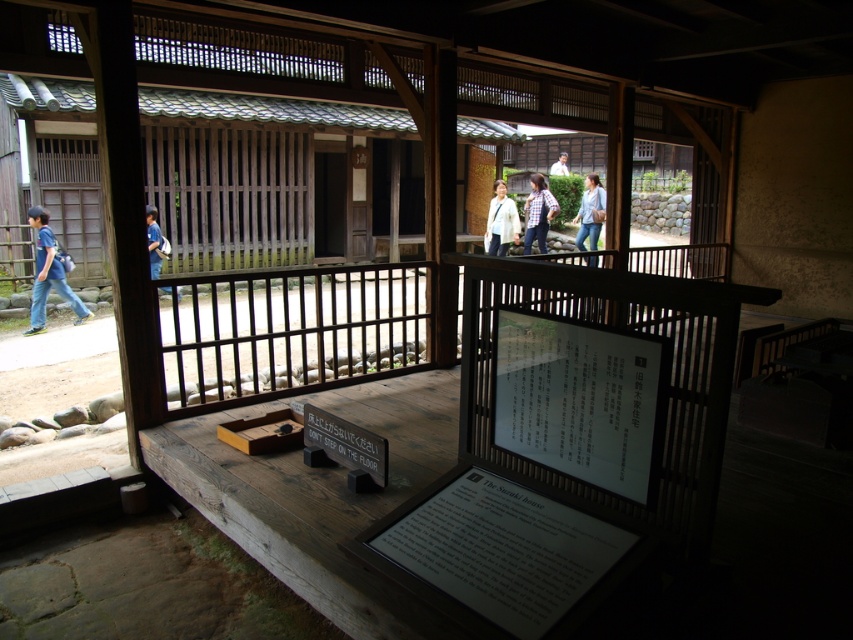
Question: Is blue fabric backpack at left bigger than white matte shirt at upper center?

Choices:
 (A) no
 (B) yes

Answer: (B)

Question: Is blue jeans at center below blue shirt at left?

Choices:
 (A) no
 (B) yes

Answer: (A)

Question: Is white paper at center to the left of checkered shirt at center from the viewer's perspective?

Choices:
 (A) yes
 (B) no

Answer: (A)

Question: Among these points, which one is nearest to the camera?

Choices:
 (A) (152, 260)
 (B) (276, 435)

Answer: (B)

Question: Which object is farther from the camera taking this photo?

Choices:
 (A) checkered shirt at center
 (B) wooden sign at center
 (C) white matte shirt at upper center

Answer: (C)

Question: Which point is closer to the camera?

Choices:
 (A) blue shirt at left
 (B) white matte shirt at upper center

Answer: (A)